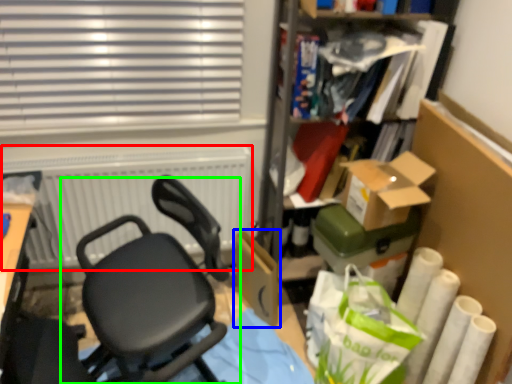
Question: Based on their relative distances, which object is nearer to radiator (highlighted by a red box)? Choose from cardboard box (highlighted by a blue box) and chair (highlighted by a green box).

Choices:
 (A) cardboard box
 (B) chair

Answer: (B)